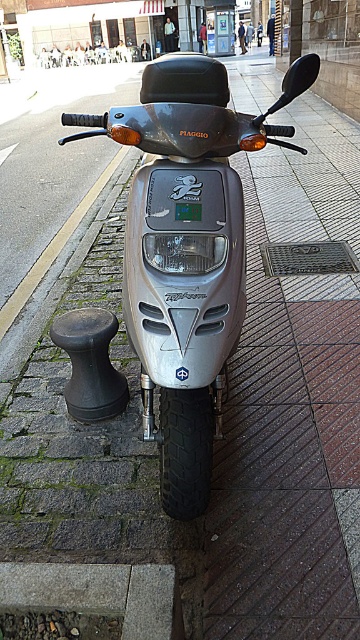
Does gray concrete curb at lower left have a greater width compared to green plastic license plate at center?

Correct, the width of gray concrete curb at lower left exceeds that of green plastic license plate at center.

Is point (169, 604) more distant than point (182, 218)?

No, it is not.

What do you see at coordinates (95, 593) in the screenshot? The width and height of the screenshot is (360, 640). I see `gray concrete curb at lower left` at bounding box center [95, 593].

The image size is (360, 640). In order to click on gray concrete curb at lower left in this screenshot , I will do `click(95, 593)`.